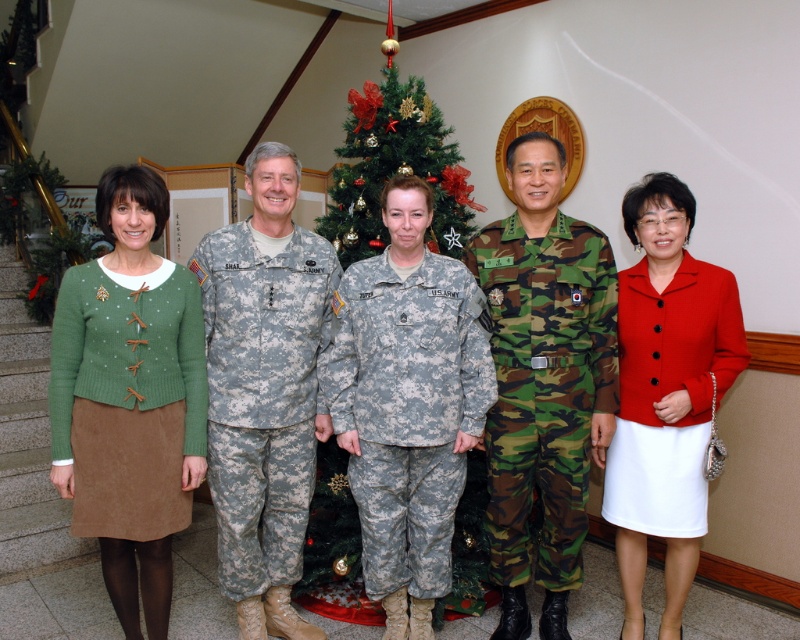
You are standing in front of the group photo and want to determine the relative positions of two points marked on the image. The first point is at coordinates point [650,508] and the second is at point [244,602]. Which point is closer to you?

Point [650,508] is closer to you because it is further to the viewer than point [244,602].